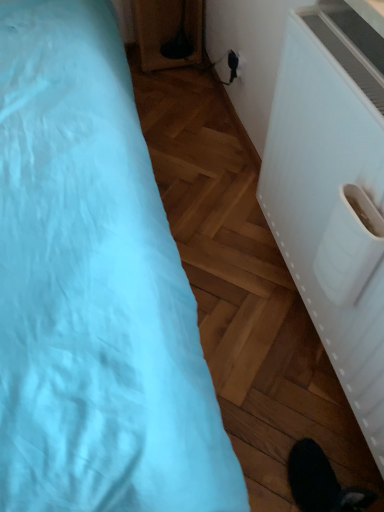
The height and width of the screenshot is (512, 384). Find the location of `black suede shoe at lower right`. black suede shoe at lower right is located at coordinates (321, 482).

The image size is (384, 512). What do you see at coordinates (321, 482) in the screenshot?
I see `black suede shoe at lower right` at bounding box center [321, 482].

Measure the distance between point (x=315, y=448) and camera.

Answer: Point (x=315, y=448) and camera are 1.01 meters apart from each other.

Identify the location of black suede shoe at lower right. (321, 482).